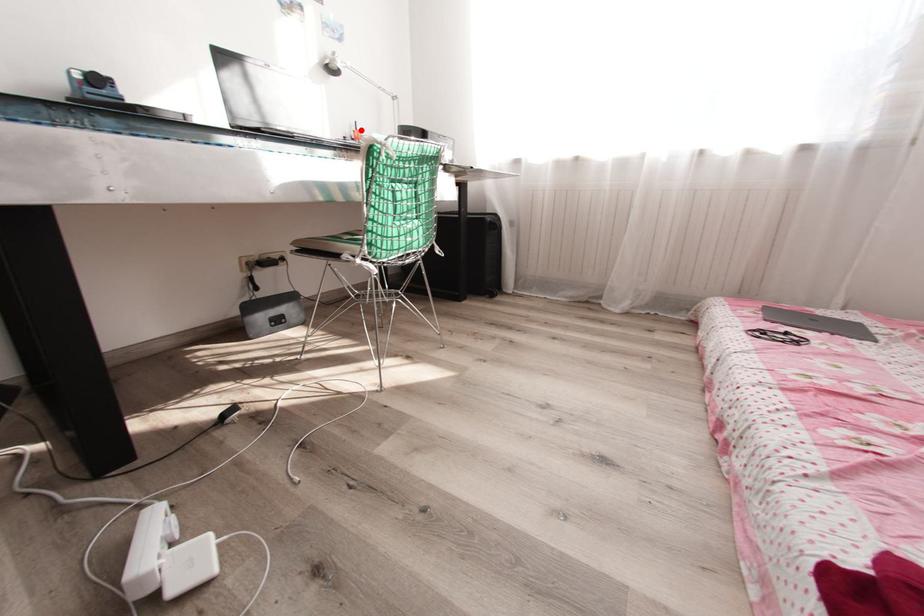
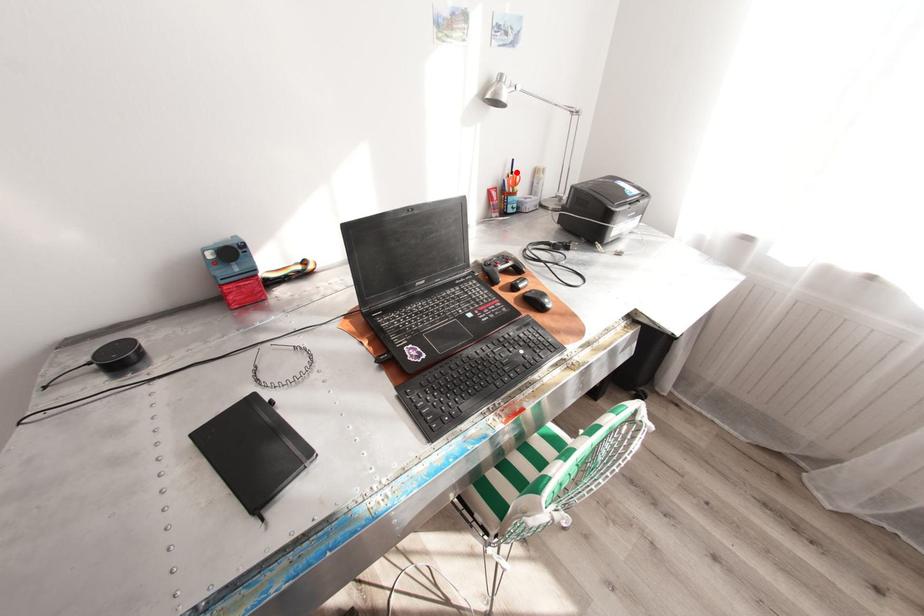
I am providing you with two images of the same scene from different viewpoints. A red point is marked on the first image and another point is marked on the second image. Does the point marked in image1 correspond to the same location as the one in image2?

Yes